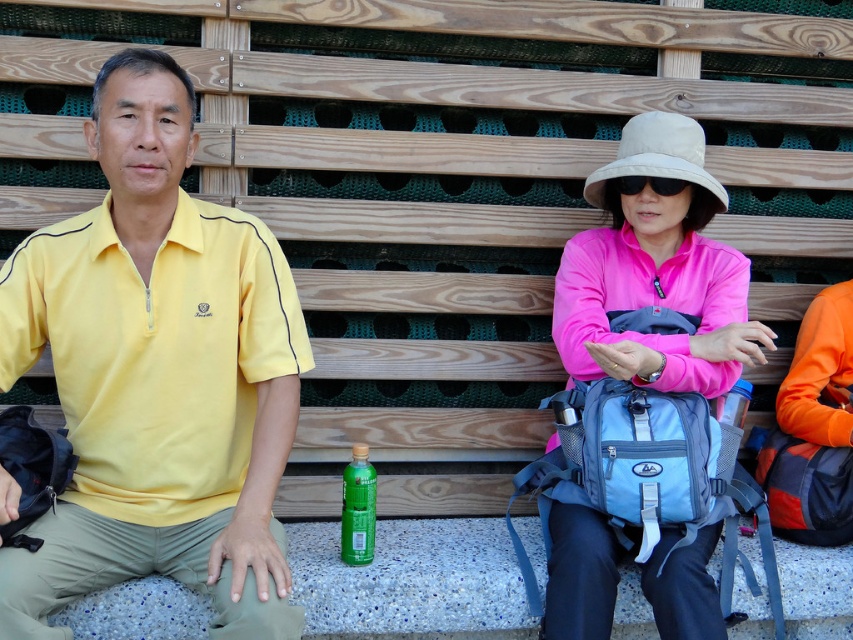
You are a photographer trying to capture a candid shot of both the yellow matte shirt at left and the pink satin hat at upper center. Given that your camera has a maximum focus range of 35 inches, can you fit both subjects into the frame without moving closer?

The distance between the yellow matte shirt at left and the pink satin hat at upper center is 38.53 inches, which exceeds the camera maximum focus range of 35 inches. Therefore, you cannot fit both subjects into the frame without moving closer.

You are a photographer standing 5 feet away from the yellow matte shirt at left and the green matte bottle at center. You want to take a photo that includes both objects in the frame. Given the distance between them, will you be able to capture both in a single shot without moving your camera?

The yellow matte shirt at left and green matte bottle at center are 18.95 inches apart. Since you are standing 5 feet away, the distance between them is relatively small compared to your distance from them. Therefore, you can capture both in a single shot without moving your camera.